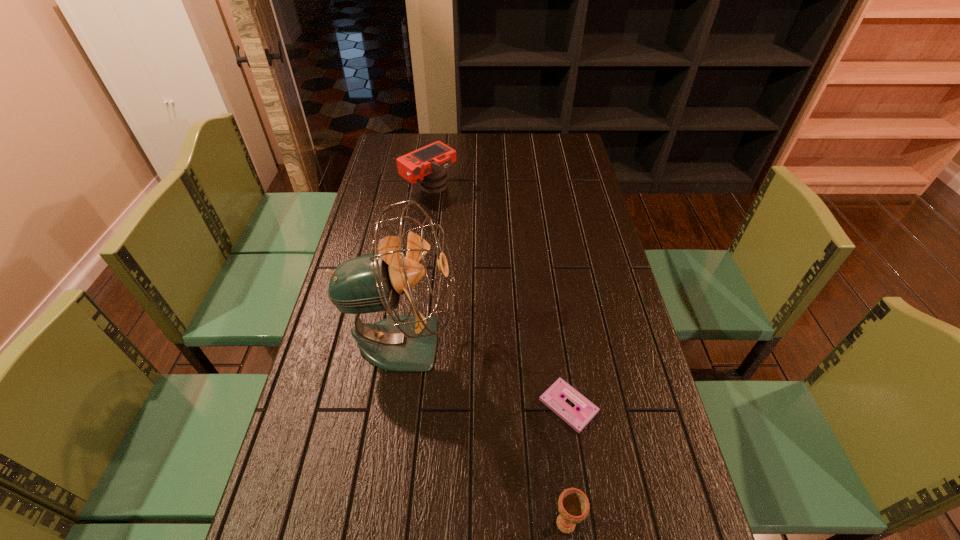
Where is `free location that satisfies the following two spatial constraints: 1. on the front side of the farthest object; 2. on the front-facing side of the tallest object for air flow`? This screenshot has width=960, height=540. free location that satisfies the following two spatial constraints: 1. on the front side of the farthest object; 2. on the front-facing side of the tallest object for air flow is located at coordinates (409, 342).